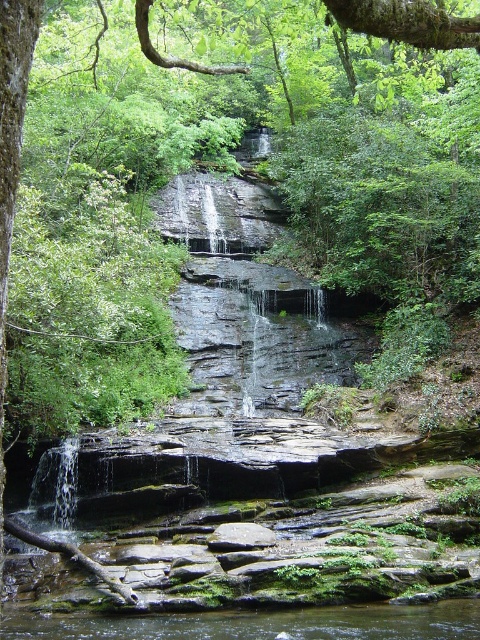
You are standing at the edge of the waterfall and want to locate the clear water at center. According to the coordinates provided, in which direction should you look relative to your position?

The clear water at center is located at coordinates point [257,624]. Since the coordinate system is not specified, it is recommended to check the image or map for the exact direction.

You are a hiker who wants to cross the stream at the waterfall. You have a 3 meter long wooden plank. The stream has clear water at center and gray smooth rock at center. Can you safely place the plank between them to cross?

The clear water at center is 3.45 meters from the gray smooth rock at center. Since the plank is only 3 meters long, it would be 0.45 meters too short to span the gap safely. You should find a longer plank or another way to cross.